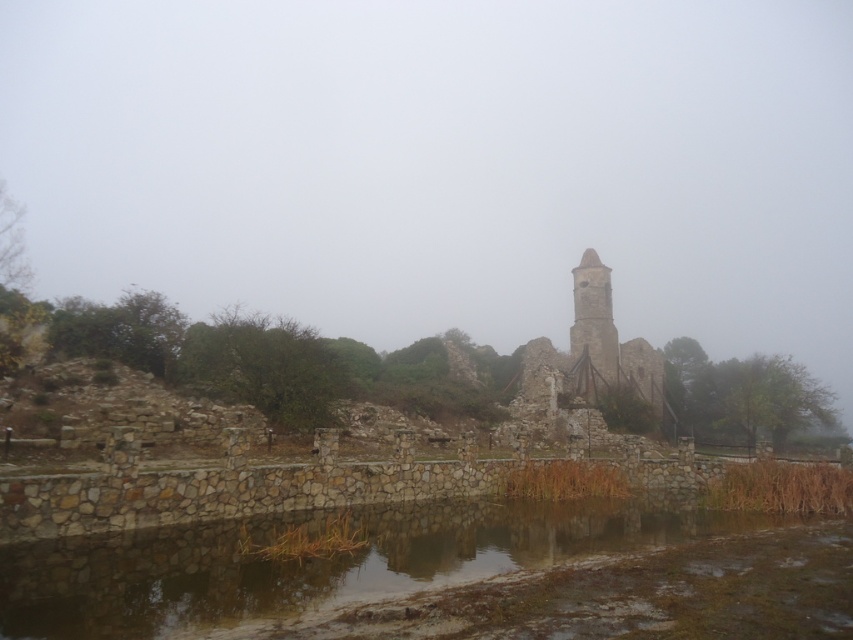
Question: Can you confirm if smooth stone river at center is positioned below rustic stone bell tower at center?

Choices:
 (A) no
 (B) yes

Answer: (B)

Question: Which of the following is the closest to the observer?

Choices:
 (A) smooth stone river at center
 (B) rustic stone tower at center
 (C) rustic stone bell tower at center

Answer: (A)

Question: Which of the following is the closest to the observer?

Choices:
 (A) (581, 342)
 (B) (701, 579)
 (C) (512, 404)

Answer: (B)

Question: Can you confirm if smooth stone river at center is smaller than rustic stone tower at center?

Choices:
 (A) yes
 (B) no

Answer: (A)

Question: Does smooth stone river at center appear over rustic stone bell tower at center?

Choices:
 (A) yes
 (B) no

Answer: (B)

Question: Which point is closer to the camera?

Choices:
 (A) smooth stone river at center
 (B) rustic stone tower at center

Answer: (A)